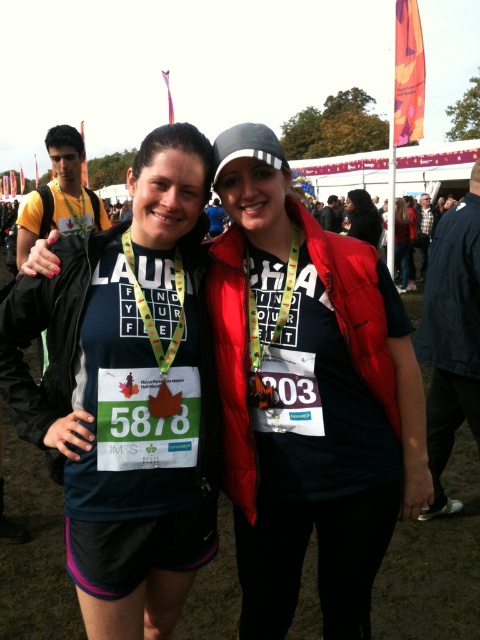
You are a photographer setting up for a group photo. You need to ensure that the black matte vest at center and the plaid fabric shirt at center are both visible in the frame. Based on their positions, which one might require you to adjust the camera angle upwards to include its entirety?

The black matte vest at center has a lesser height compared to the plaid fabric shirt at center, so you would need to adjust the camera angle upwards to include the entirety of the plaid fabric shirt at center.

You are a photographer at the event and need to adjust the camera focus. Which of the two items, the matte black vest at center or the matte black jacket at center, is closer to the camera?

The matte black vest at center is smaller than the matte black jacket at center, so the vest is closer to the camera.